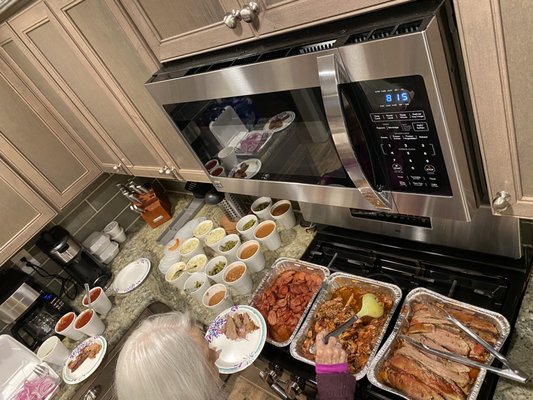
I want to click on microwave, so click(x=308, y=114).